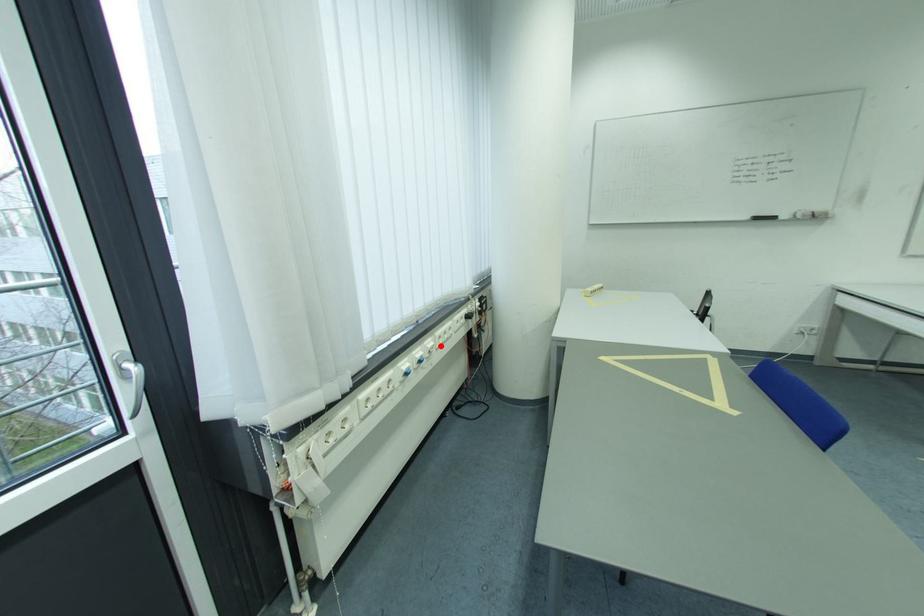
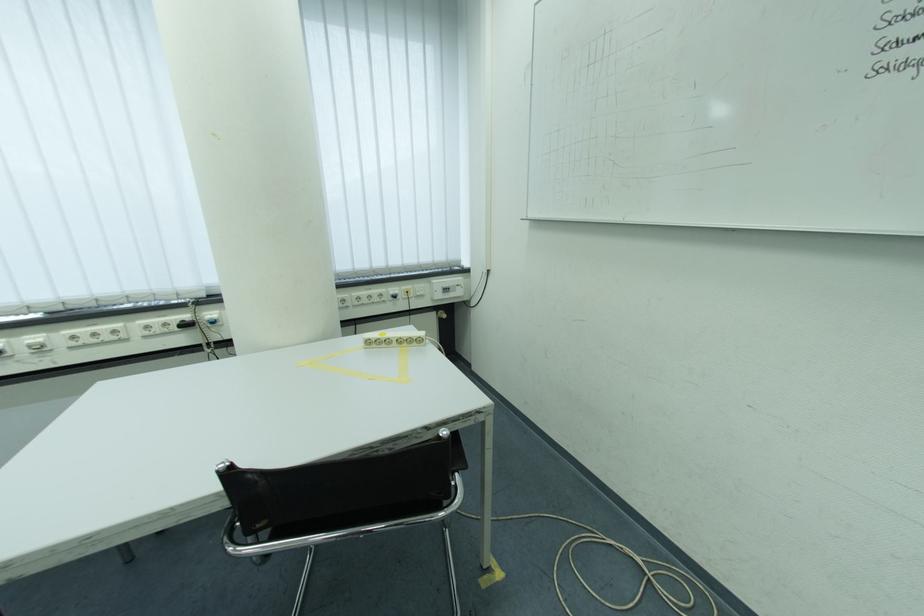
Question: I am providing you with two images of the same scene from different viewpoints. A red point is marked on the first image. At the location where the point appears in image 1, is it still visible in image 2?

Choices:
 (A) Yes
 (B) No

Answer: (A)